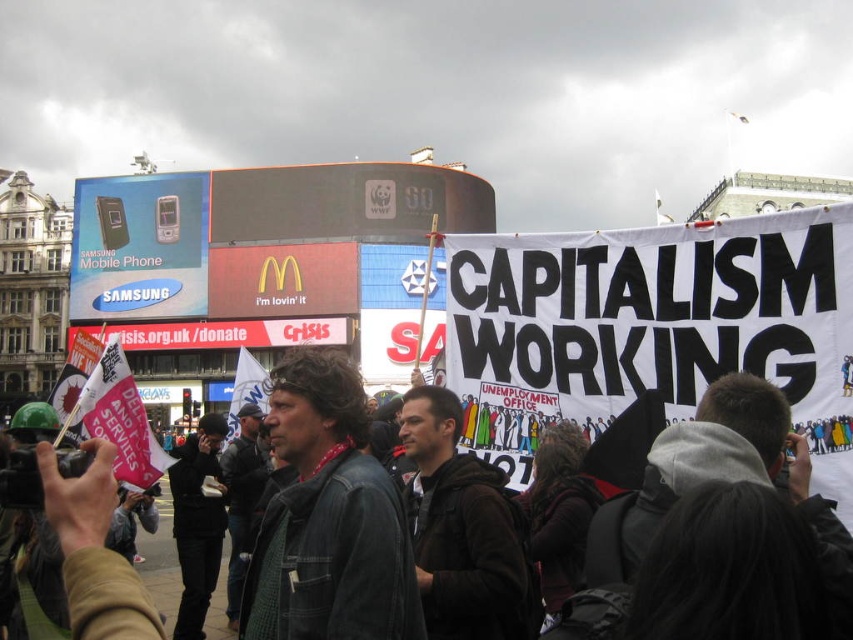
Which is below, dark brown leather jacket at center or denim jacket at center?

denim jacket at center is lower down.

Measure the distance between point (91,534) and camera.

A distance of 198.78 feet exists between point (91,534) and camera.

Find the location of a particular element. The width and height of the screenshot is (853, 640). dark brown leather jacket at center is located at coordinates (338, 512).

Does point (340, 374) lie behind point (102, 225)?

No, (340, 374) is in front of (102, 225).

Is point (355, 492) closer to viewer compared to point (134, 314)?

Yes, point (355, 492) is in front of point (134, 314).

Find the location of `denim jacket at center`. denim jacket at center is located at coordinates (328, 516).

Looking at this image, who is positioned more to the right, dark brown leather jacket at center or metallic glossy mobile phone at upper left?

From the viewer's perspective, dark brown leather jacket at center appears more on the right side.

Which is behind, point (97, 627) or point (189, 224)?

Point (189, 224)

The width and height of the screenshot is (853, 640). I want to click on dark brown leather jacket at center, so click(338, 512).